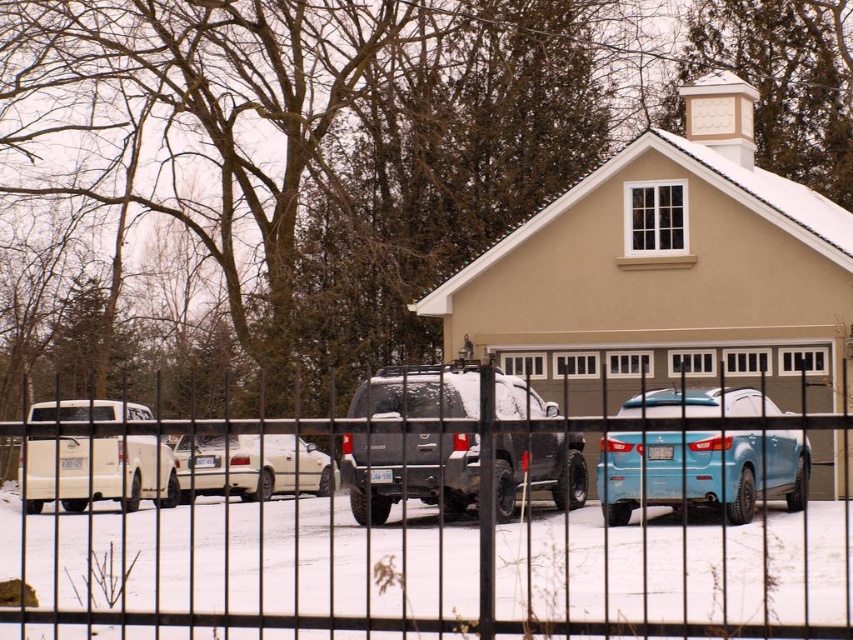
Between white matte truck at left and white matte sedan at center, which one appears on the right side from the viewer's perspective?

Positioned to the right is white matte sedan at center.

Does point (97, 483) lie in front of point (285, 476)?

Yes, it is in front of point (285, 476).

Is point (120, 492) closer to camera compared to point (287, 440)?

Yes, it is.

Find the location of a particular element. The width and height of the screenshot is (853, 640). white matte truck at left is located at coordinates (125, 468).

Is point (373, 568) farther from viewer compared to point (231, 461)?

No, (373, 568) is in front of (231, 461).

Which is more to the right, black metal fence at center or white matte sedan at center?

From the viewer's perspective, black metal fence at center appears more on the right side.

What do you see at coordinates (422, 525) in the screenshot?
I see `black metal fence at center` at bounding box center [422, 525].

Identify the location of black metal fence at center. (422, 525).

Can you confirm if light blue matte sedan at center is bigger than white matte truck at left?

No, light blue matte sedan at center is not bigger than white matte truck at left.

Where is `light blue matte sedan at center`? Image resolution: width=853 pixels, height=640 pixels. light blue matte sedan at center is located at coordinates click(x=701, y=470).